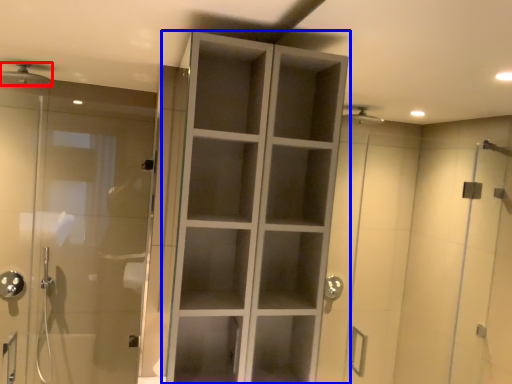
Question: Which of the following is the closest to the observer, shower (highlighted by a red box) or cupboard (highlighted by a blue box)?

Choices:
 (A) shower
 (B) cupboard

Answer: (B)